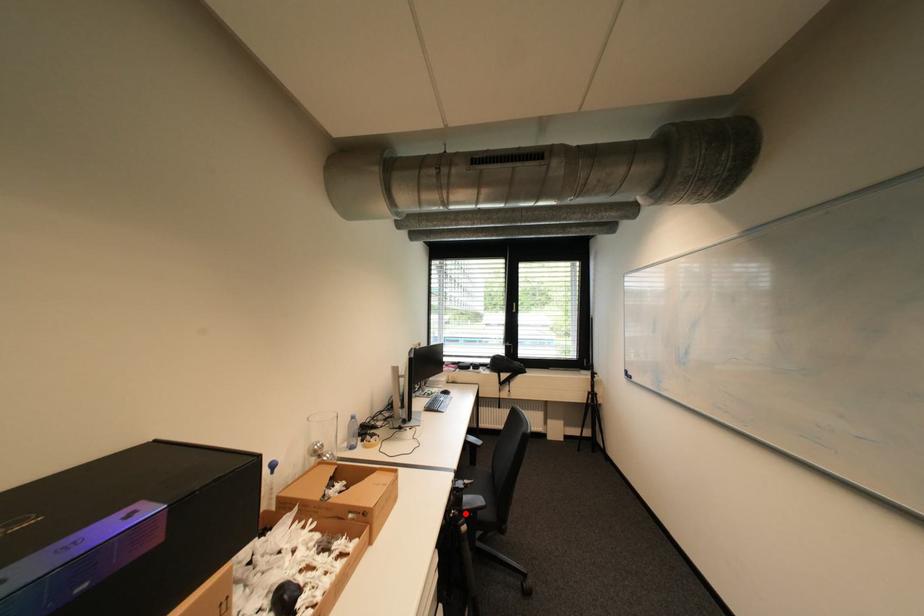
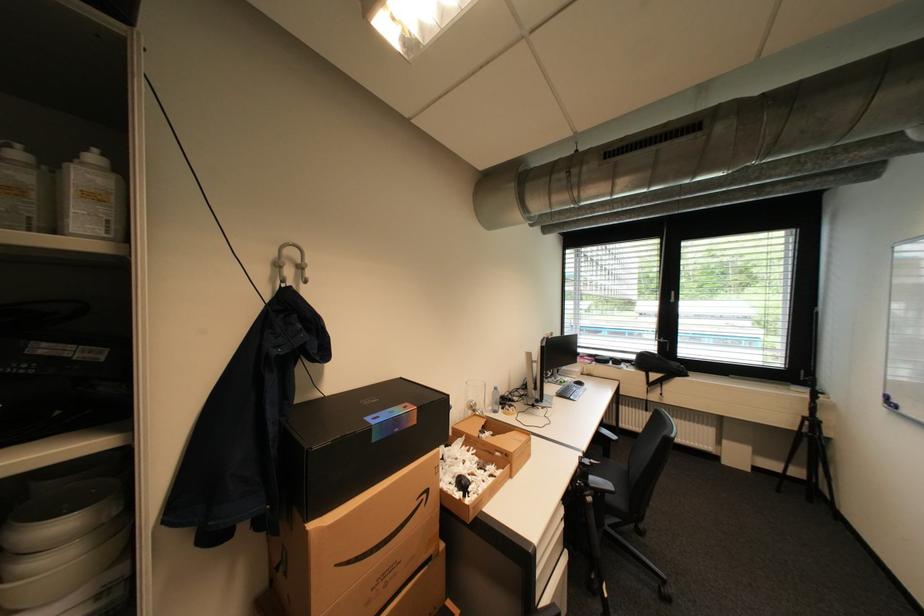
Where in the second image is the point corresponding to the highlighted location from the first image?

(591, 485)